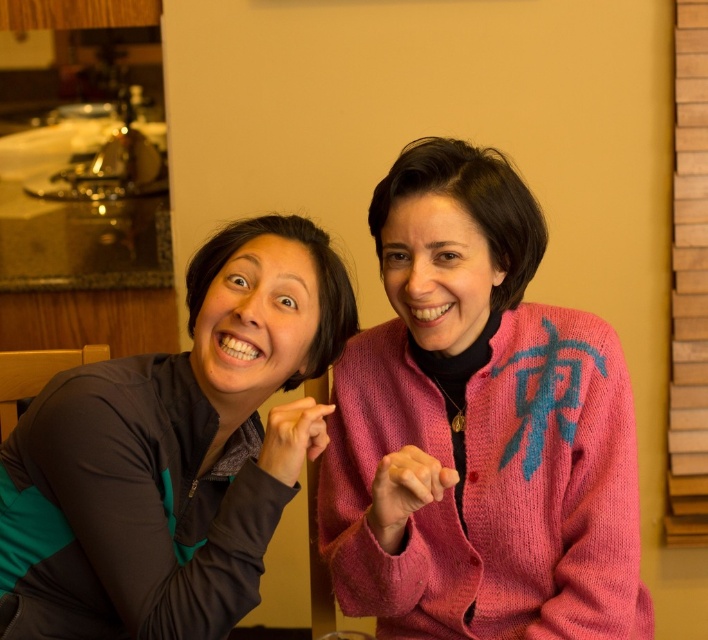
The image size is (708, 640). I want to click on pink knitted sweater at center, so click(x=479, y=428).